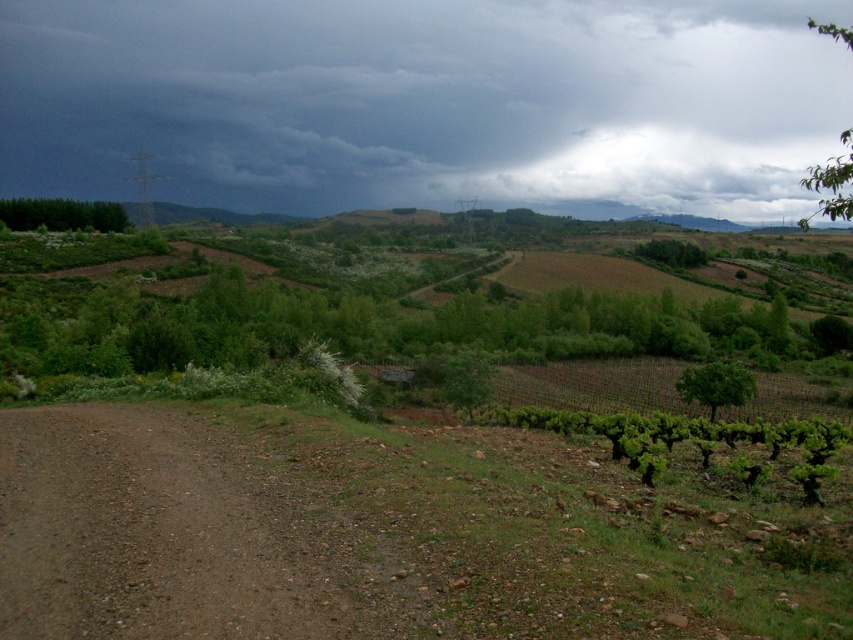
Can you confirm if dark gray cloud at upper center is positioned to the right of green leafy trees at left?

Correct, you'll find dark gray cloud at upper center to the right of green leafy trees at left.

Is dark gray cloud at upper center positioned before green leafy trees at left?

No, dark gray cloud at upper center is behind green leafy trees at left.

Is point (556, 19) closer to viewer compared to point (56, 216)?

No, (556, 19) is behind (56, 216).

At what (x,y) coordinates should I click in order to perform the action: click on dark gray cloud at upper center. Please return your answer as a coordinate pair (x, y). The height and width of the screenshot is (640, 853). Looking at the image, I should click on (422, 100).

Which is behind, point (811, 22) or point (685, 241)?

Point (811, 22)

The image size is (853, 640). I want to click on green leafy tree at upper right, so click(833, 182).

The height and width of the screenshot is (640, 853). In order to click on green leafy tree at upper right in this screenshot , I will do `click(833, 182)`.

Can you confirm if green leafy tree at upper right is positioned to the left of green leafy tree at center-right?

Incorrect, green leafy tree at upper right is not on the left side of green leafy tree at center-right.

Can you confirm if green leafy tree at upper right is thinner than green leafy tree at center-right?

In fact, green leafy tree at upper right might be wider than green leafy tree at center-right.

I want to click on green leafy tree at upper right, so click(833, 182).